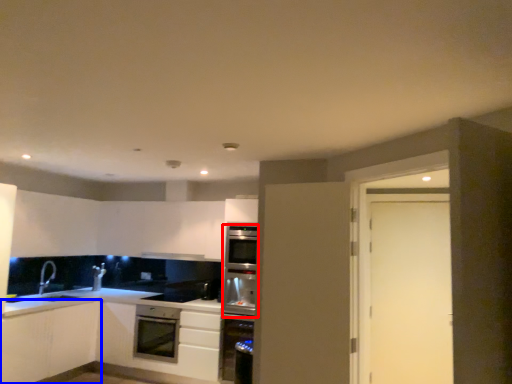
Question: Which object is further to the camera taking this photo, oven (highlighted by a red box) or cabinetry (highlighted by a blue box)?

Choices:
 (A) oven
 (B) cabinetry

Answer: (A)